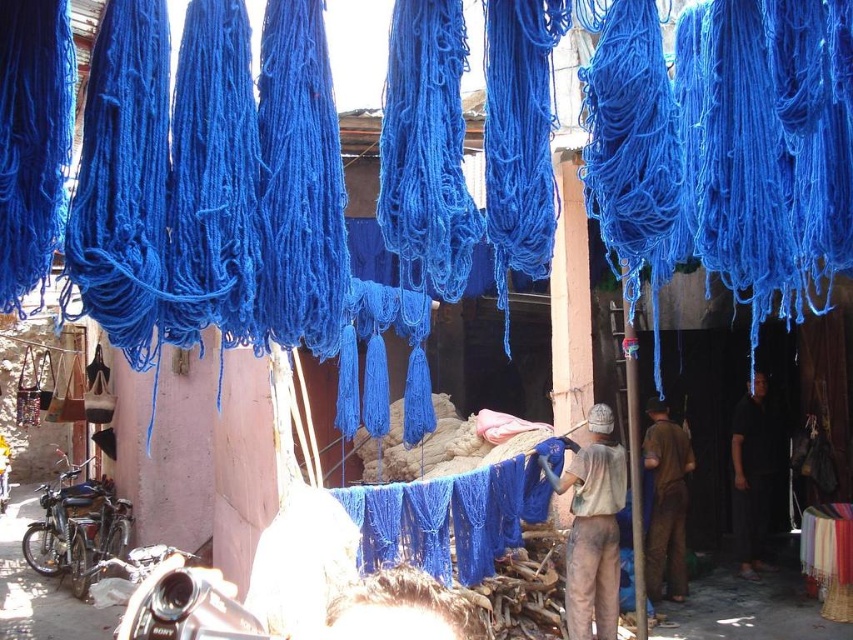
Question: Which of the following is the farthest from the observer?

Choices:
 (A) black cotton shirt at center
 (B) dirty beige shirt at center
 (C) brown fabric at center

Answer: (A)

Question: Considering the real-world distances, which object is farthest from the black cotton shirt at center?

Choices:
 (A) dirty beige shirt at center
 (B) brown fabric at center

Answer: (A)

Question: From the image, what is the correct spatial relationship of dirty beige shirt at center in relation to black cotton shirt at center?

Choices:
 (A) below
 (B) above

Answer: (B)

Question: Does dirty beige shirt at center come in front of brown fabric at center?

Choices:
 (A) yes
 (B) no

Answer: (A)

Question: Which of the following is the closest to the observer?

Choices:
 (A) brown fabric at center
 (B) black cotton shirt at center
 (C) dirty beige shirt at center

Answer: (C)

Question: Can you confirm if dirty beige shirt at center is smaller than black cotton shirt at center?

Choices:
 (A) no
 (B) yes

Answer: (B)